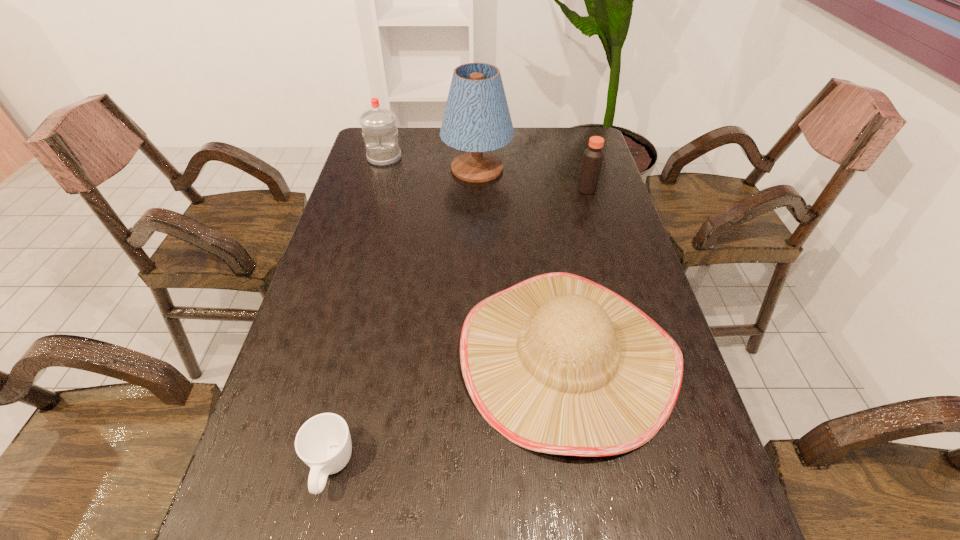
Locate an element on the screen. This screenshot has height=540, width=960. lampshade is located at coordinates (476, 119).

The width and height of the screenshot is (960, 540). Find the location of `water bottle`. water bottle is located at coordinates (379, 130).

Find the location of a particular element. vinegar is located at coordinates (593, 157).

Locate an element on the screen. sunhat is located at coordinates (559, 364).

This screenshot has height=540, width=960. Identify the location of cup. (323, 442).

Locate an element on the screen. Image resolution: width=960 pixels, height=540 pixels. free point located 0.120m on the right of the lampshade is located at coordinates (546, 168).

What are the coordinates of `free space located 0.310m on the handle side of the fourth shortest object` in the screenshot? It's located at (366, 224).

The width and height of the screenshot is (960, 540). I want to click on vacant space located 0.370m on the front of the vinegar, so click(x=612, y=277).

This screenshot has width=960, height=540. Find the location of `vacant area situated 0.200m on the left of the sunhat`. vacant area situated 0.200m on the left of the sunhat is located at coordinates (372, 357).

The height and width of the screenshot is (540, 960). I want to click on lampshade that is at the far edge, so click(x=476, y=119).